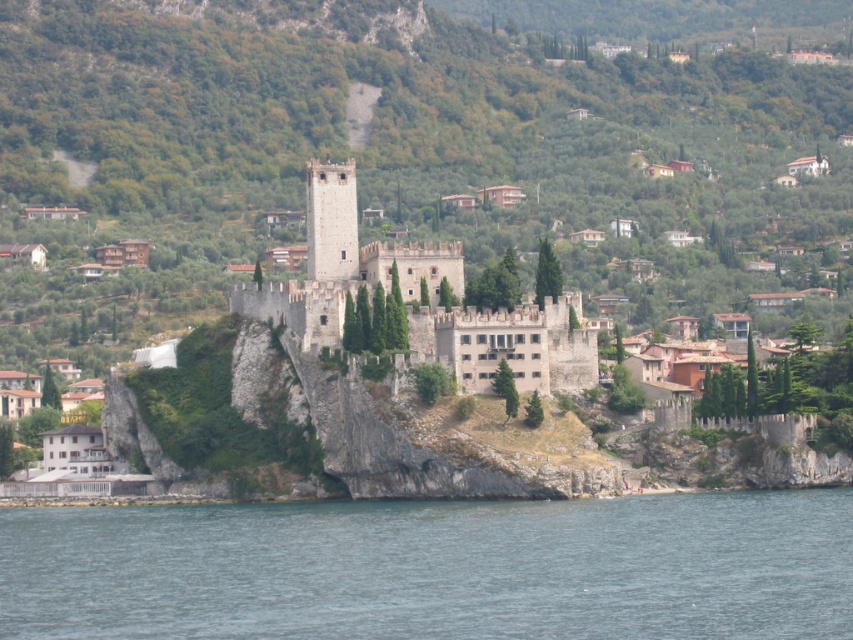
Is clear blue water at lower center shorter than white stone castle at center?

Correct, clear blue water at lower center is not as tall as white stone castle at center.

Does clear blue water at lower center lie in front of white stone castle at center?

Yes, clear blue water at lower center is closer to the viewer.

Which is behind, point (770, 524) or point (335, 305)?

The point (335, 305) is more distant.

At what (x,y) coordinates should I click in order to perform the action: click on clear blue water at lower center. Please return your answer as a coordinate pair (x, y). This screenshot has width=853, height=640. Looking at the image, I should click on (434, 568).